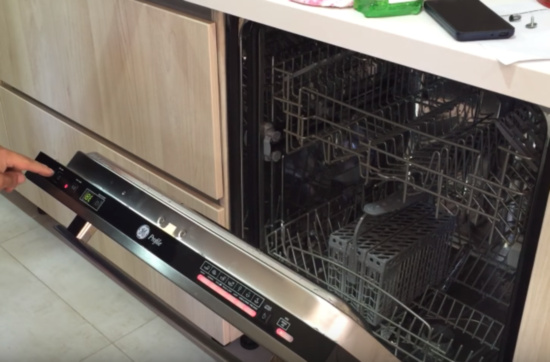
This screenshot has height=362, width=550. I want to click on kitchen drawer, so click(120, 58).